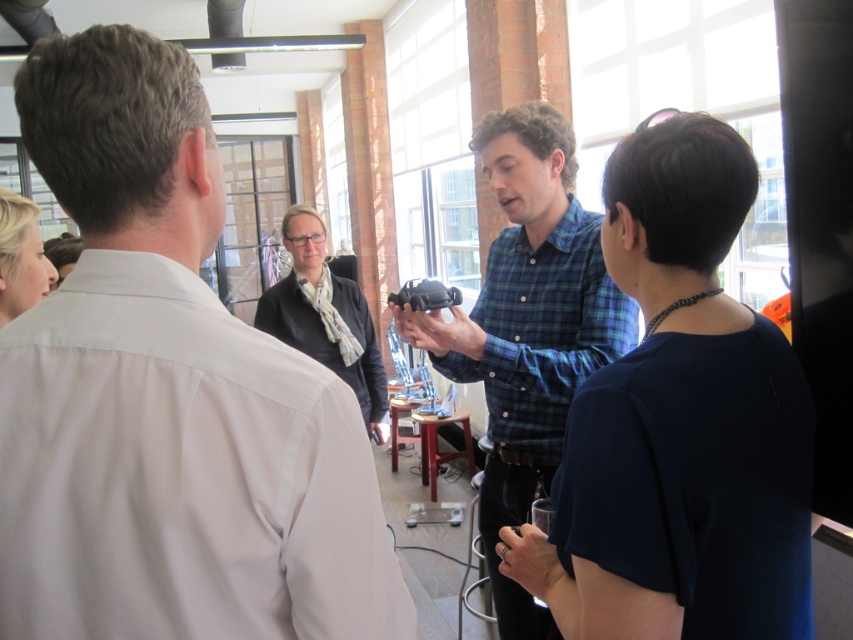
You are organizing a photoshoot and need to know the relative sizes of the dark gray sweater at center and the blonde hair at upper left. Which one is wider?

The dark gray sweater at center is less wide than the blonde hair at upper left.

You are standing in the room and want to move from point A to point B. Point A is at coordinate point(315, 250) and point B is at coordinate point(25, 200). Which point is closer to you?

Point A at coordinate point(315, 250) is closer to you because it is further to the camera than point B at coordinate point(25, 200).